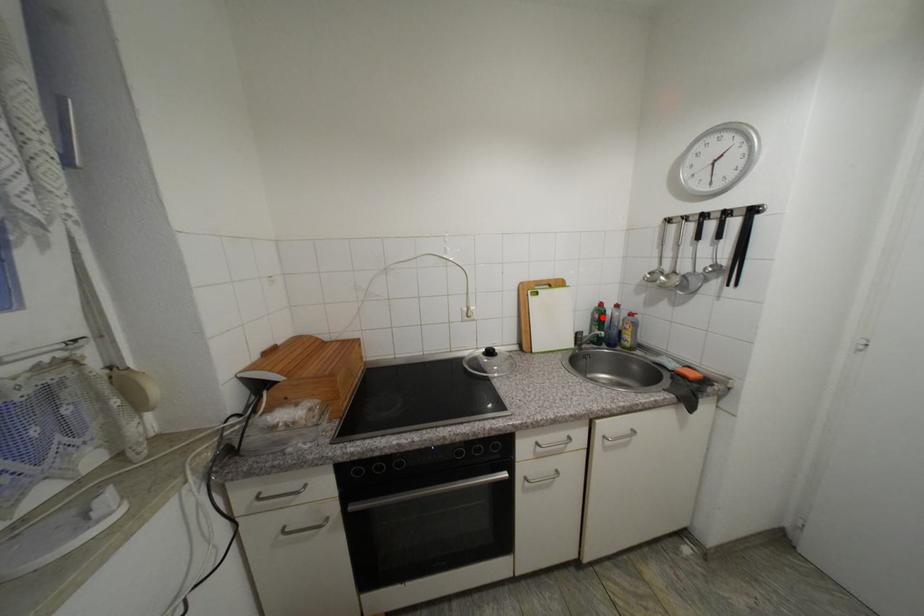
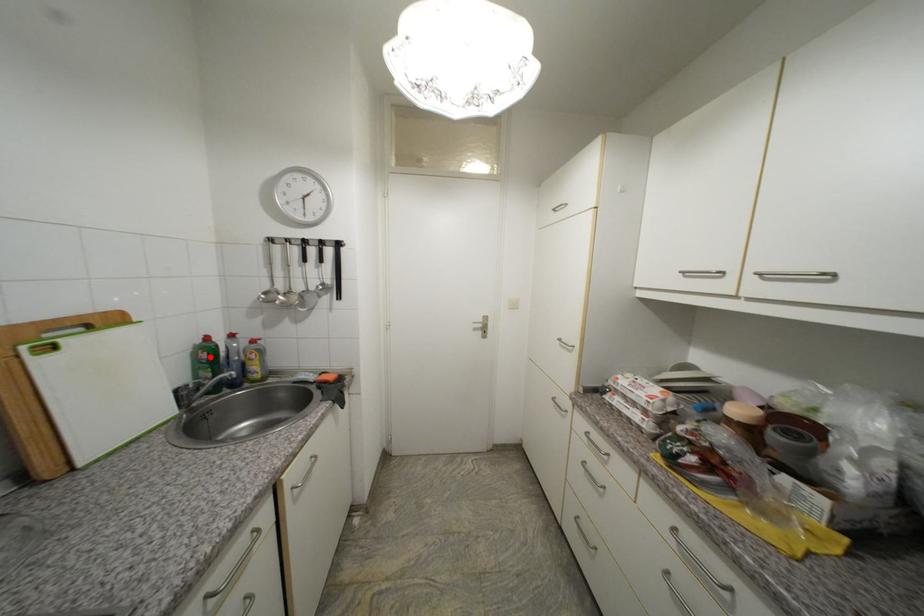
I am providing you with two images of the same scene from different viewpoints. A red point is marked on the first image and another point is marked on the second image. Is the red point in image1 aligned with the point shown in image2?

Yes